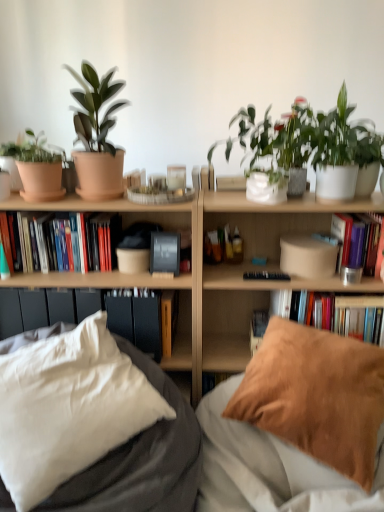
Question: Looking at their shapes, would you say brown suede pillow at lower right, the first pillow when ordered from right to left, is wider or thinner than matte clay pot at left, which appears as the 3th flowerpot when viewed from the right?

Choices:
 (A) thin
 (B) wide

Answer: (B)

Question: Is brown suede pillow at lower right, which is the second pillow from left to right, in front of or behind matte clay pot at left, acting as the 1th flowerpot starting from the left, in the image?

Choices:
 (A) front
 (B) behind

Answer: (A)

Question: Which object is the closest to the hardcover book at upper right, the second book when ordered from right to left?

Choices:
 (A) green matte plant at upper right, which appears as the 3th houseplant when viewed from the left
 (B) matte brown pot at center, the 2th flowerpot viewed from the right
 (C) brown suede pillow at lower right, which is the second pillow from left to right
 (D) black matte book at center, placed as the 2th paperback book when sorted from bottom to top
 (E) wooden paperback book at center, the 3th paperback book viewed from the top

Answer: (C)

Question: Which is farther from the matte terracotta pot at upper left, which ranks as the 2th houseplant in right-to-left order?

Choices:
 (A) hardcover books at left, which appears as the 3th book when viewed from the right
 (B) matte terracotta pot at left, the third houseplant in the right-to-left sequence
 (C) brown suede pillow at lower right, the first pillow when ordered from right to left
 (D) black matte book at center, which is counted as the second paperback book, starting from the top
 (E) black matte book at center, which appears as the 1th paperback book when viewed from the top

Answer: (C)